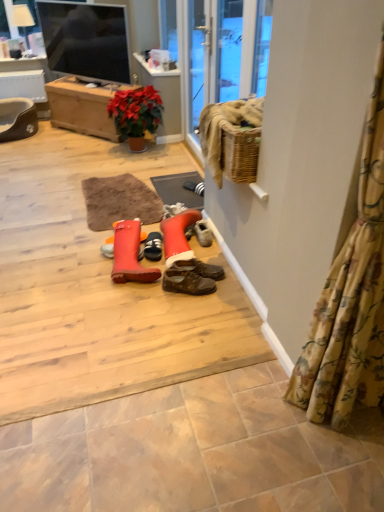
Locate an element on the screen. Image resolution: width=384 pixels, height=512 pixels. vacant area on top of brown leather shoes at center, the third footwear from the left (from a real-world perspective) is located at coordinates (186, 264).